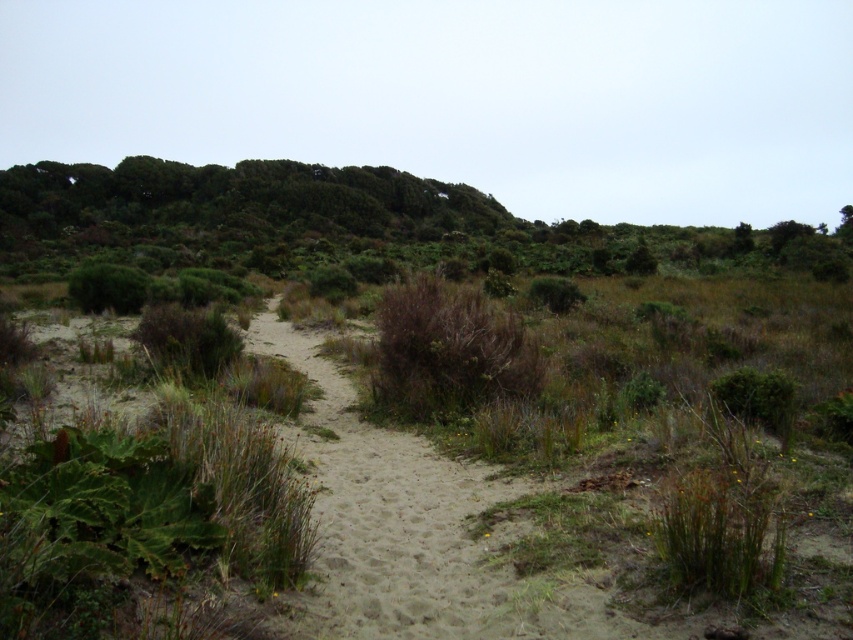
Question: Does brown dry bush at lower left appear under green fuzzy bush at lower left?

Choices:
 (A) yes
 (B) no

Answer: (A)

Question: Does brown fuzzy bush at center have a larger size compared to green leafy bush at lower right?

Choices:
 (A) no
 (B) yes

Answer: (B)

Question: Is brown fuzzy bush at center thinner than green fuzzy bush at lower left?

Choices:
 (A) no
 (B) yes

Answer: (B)

Question: Among these objects, which one is nearest to the camera?

Choices:
 (A) brown fuzzy bush at center
 (B) green fuzzy bush at lower left

Answer: (A)

Question: Which point is farther from the camera taking this photo?

Choices:
 (A) (96, 292)
 (B) (747, 369)

Answer: (A)

Question: Which point is closer to the camera?

Choices:
 (A) (103, 282)
 (B) (206, 356)

Answer: (B)